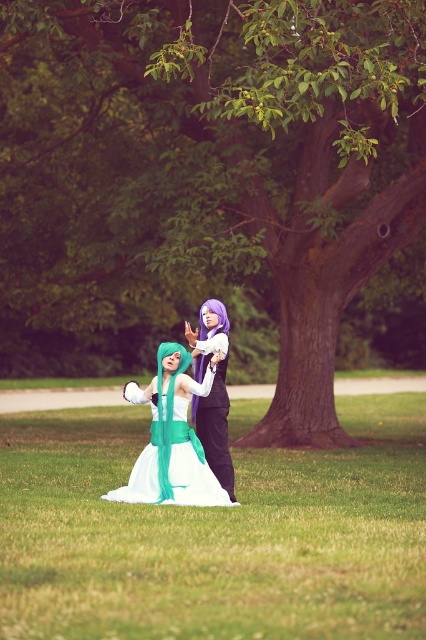
Between green leafy tree at center and green grass at center, which one has less height?

Standing shorter between the two is green grass at center.

Can you confirm if green leafy tree at center is bigger than green grass at center?

Correct, green leafy tree at center is larger in size than green grass at center.

Is point (48, 80) closer to viewer compared to point (120, 608)?

No, (48, 80) is further to viewer.

The image size is (426, 640). In order to click on green leafy tree at center in this screenshot , I will do `click(222, 156)`.

Can you confirm if green grass at center is smaller than white satin dress at center?

No.

Measure the distance between green grass at center and camera.

A distance of 5.68 meters exists between green grass at center and camera.

Identify the location of green grass at center. The image size is (426, 640). (213, 534).

Find the location of a particular element. green grass at center is located at coordinates (213, 534).

Between point (19, 24) and point (138, 403), which one is positioned in front?

Positioned in front is point (138, 403).

In the scene shown: Is green leafy tree at center taller than white satin dress at center?

Indeed, green leafy tree at center has a greater height compared to white satin dress at center.

Where is `green leafy tree at center`? green leafy tree at center is located at coordinates (222, 156).